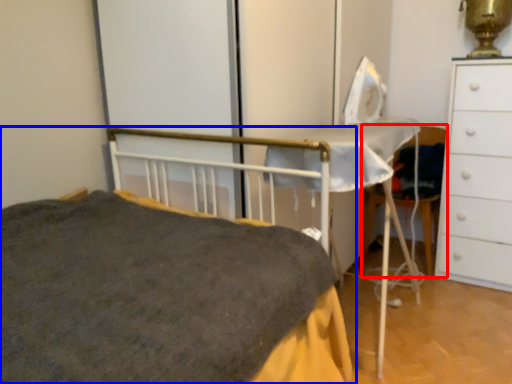
Question: Among these objects, which one is farthest to the camera, chair (highlighted by a red box) or bed (highlighted by a blue box)?

Choices:
 (A) chair
 (B) bed

Answer: (A)